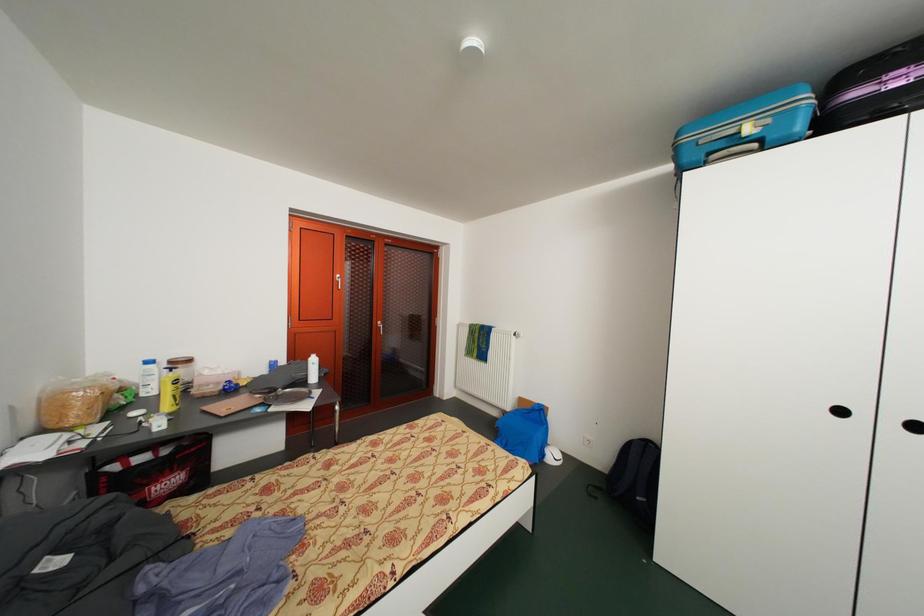
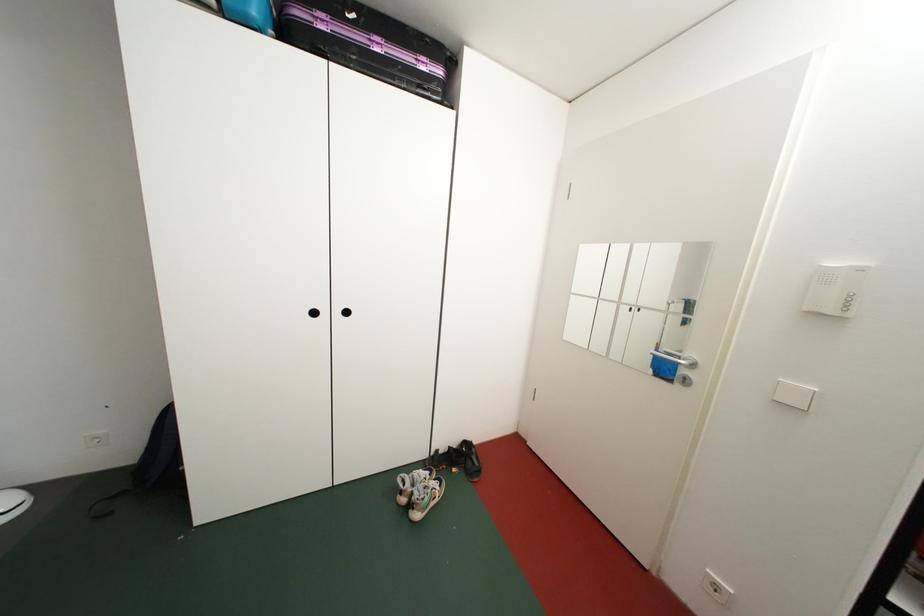
Question: Based on the continuous images, in which direction is the camera rotating? Reply with the corresponding letter.

Choices:
 (A) Left
 (B) Right
 (C) Up
 (D) Down

Answer: (B)